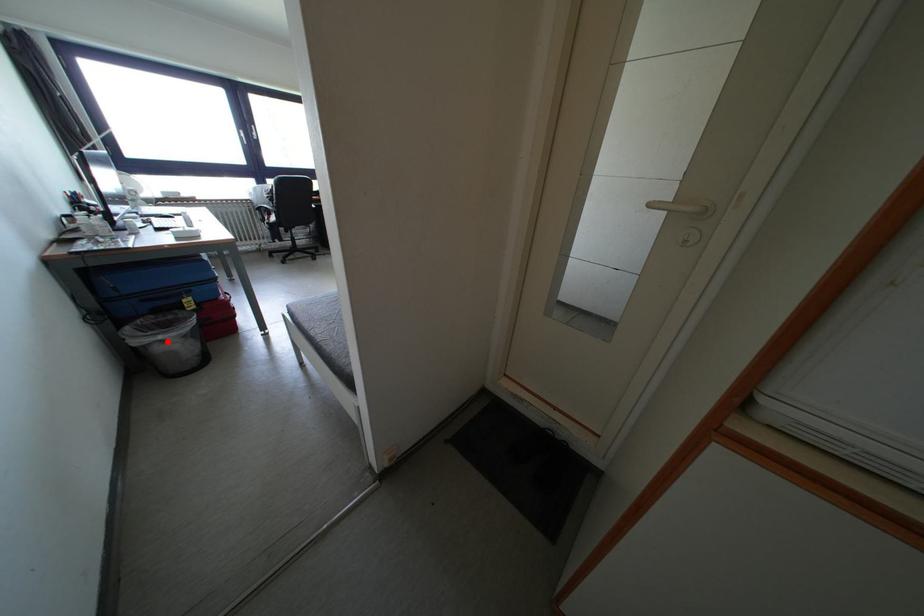
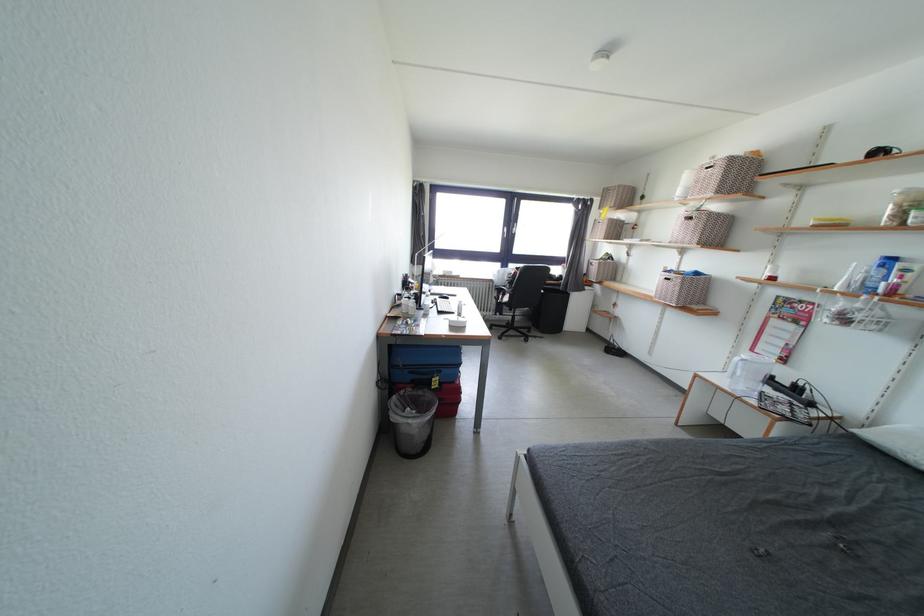
Question: I am providing you with two images of the same scene from different viewpoints. In image1, a red point is highlighted. Considering the same 3D point in image2, which of the following is correct?

Choices:
 (A) It is closer
 (B) It is farther

Answer: (B)